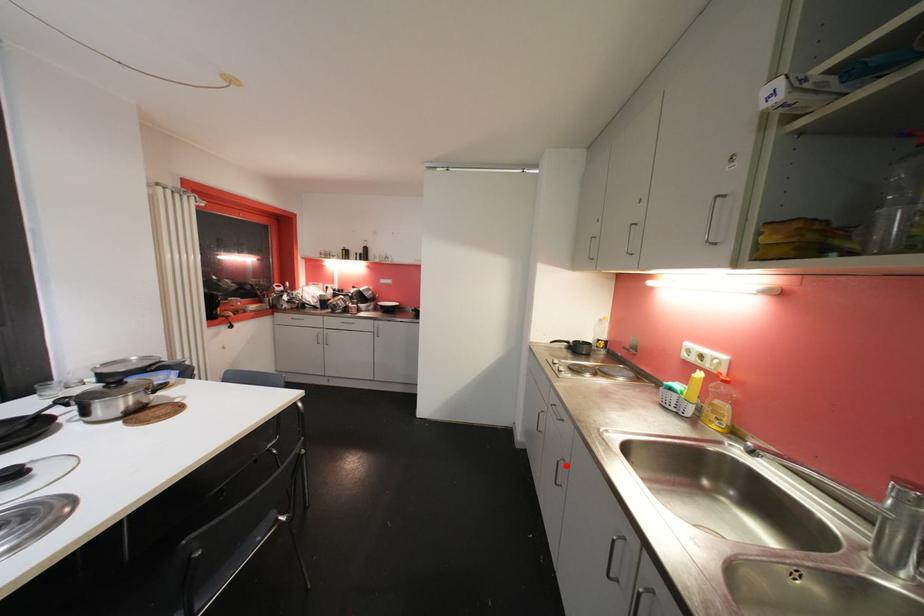
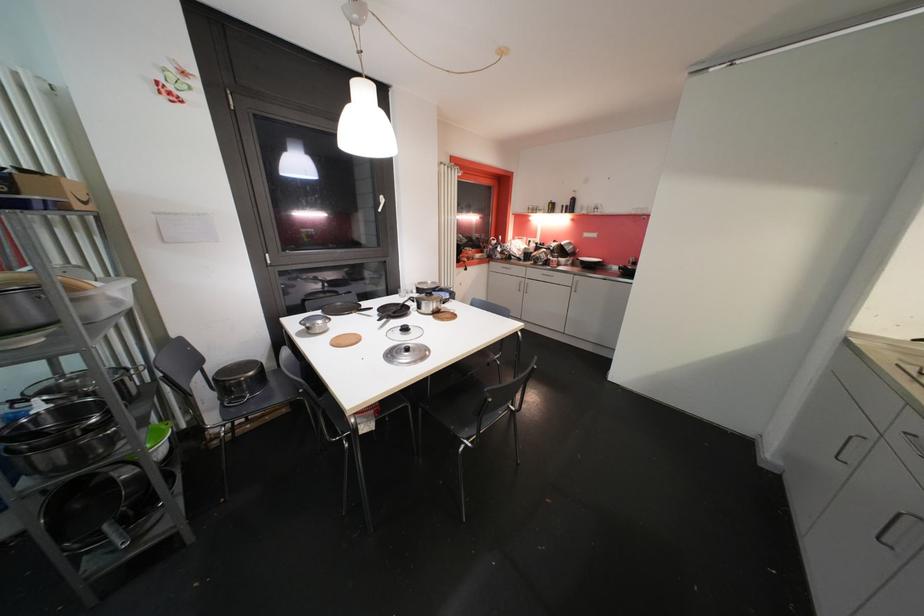
In the second image, find the point that corresponds to the highlighted location in the first image.

(915, 522)